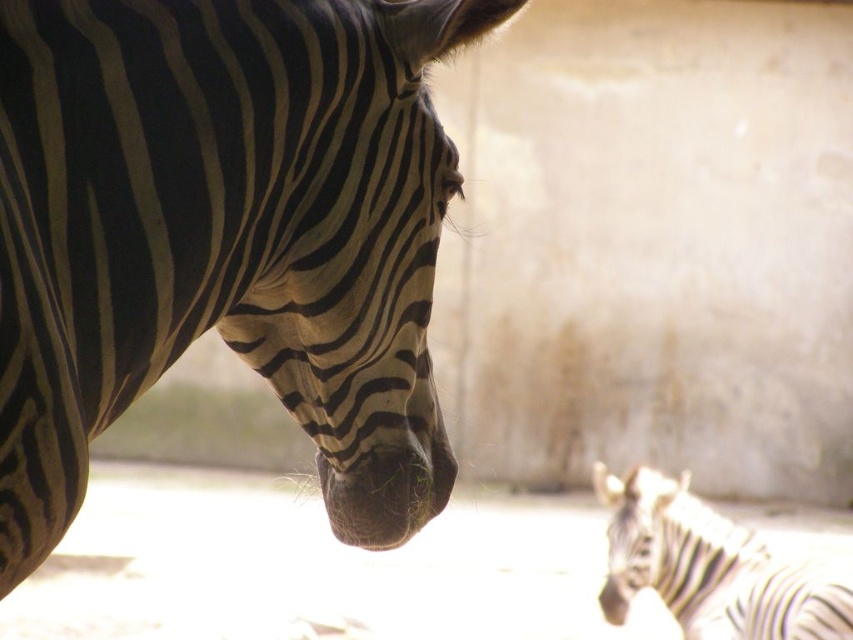
Where is the black and white striped zebra at left located in the image?

The black and white striped zebra at left is located at point (224, 236).

You are a photographer trying to capture the zebra in the foreground. You want to focus on the point that is closer to the camera. Which point should you choose between point (796,605) and point (618,621)?

Point (796,605) is closer to the camera than point (618,621), so you should choose point (796,605) to focus on.

You are a zookeeper trying to feed the zebras. You have a bucket of food and are standing in the middle of the enclosure. Which zebra, the black and white striped zebra at left or the black and white striped zebra at lower right, is closer to you?

The black and white striped zebra at left is closer to you since it is in front of the black and white striped zebra at lower right.